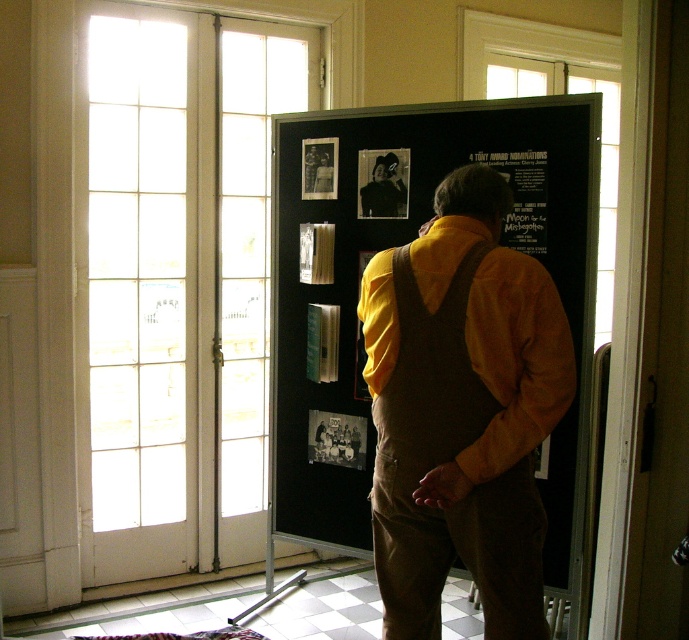
Question: Which point is farther to the camera?

Choices:
 (A) wooden frame at center
 (B) brown suede overalls at center
 (C) black paper poster at upper center

Answer: (A)

Question: Which object is closer to the camera taking this photo?

Choices:
 (A) black paper at center
 (B) black paper poster at upper center
 (C) white glass door at left
 (D) black glossy photo at center

Answer: (D)

Question: Is white glass door at left thinner than black paper at center?

Choices:
 (A) no
 (B) yes

Answer: (A)

Question: Can you confirm if black paper at center is positioned to the right of wooden frame at center?

Choices:
 (A) yes
 (B) no

Answer: (A)

Question: Observing the image, what is the correct spatial positioning of black paper poster at upper center in reference to wooden frame at center?

Choices:
 (A) left
 (B) right

Answer: (B)

Question: Based on their relative distances, which object is farther from the white glass door at left?

Choices:
 (A) black glossy photo at center
 (B) wooden frame at center

Answer: (A)